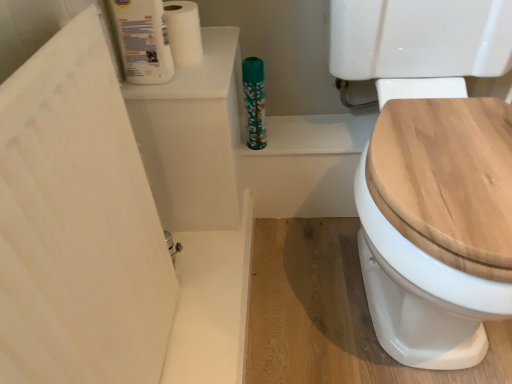
Question: From a real-world perspective, relative to white glossy toilet paper at upper left, placed as the second toilet paper when sorted from back to front, is teal floral-patterned bottle at upper center vertically above or below?

Choices:
 (A) above
 (B) below

Answer: (B)

Question: In terms of size, does teal floral-patterned bottle at upper center appear bigger or smaller than white glossy toilet paper at upper left, placed as the second toilet paper when sorted from back to front?

Choices:
 (A) small
 (B) big

Answer: (A)

Question: Which object is positioned farthest from the teal floral-patterned bottle at upper center?

Choices:
 (A) white matte toilet paper at upper left, positioned as the second toilet paper in front-to-back order
 (B) wooden toilet seat at right
 (C) white glossy toilet paper at upper left, the first toilet paper in the front-to-back sequence

Answer: (B)

Question: Estimate the real-world distances between objects in this image. Which object is farther from the teal floral-patterned bottle at upper center?

Choices:
 (A) white glossy toilet paper at upper left, placed as the second toilet paper when sorted from back to front
 (B) white matte toilet paper at upper left, positioned as the second toilet paper in front-to-back order
 (C) wooden toilet seat at right

Answer: (C)